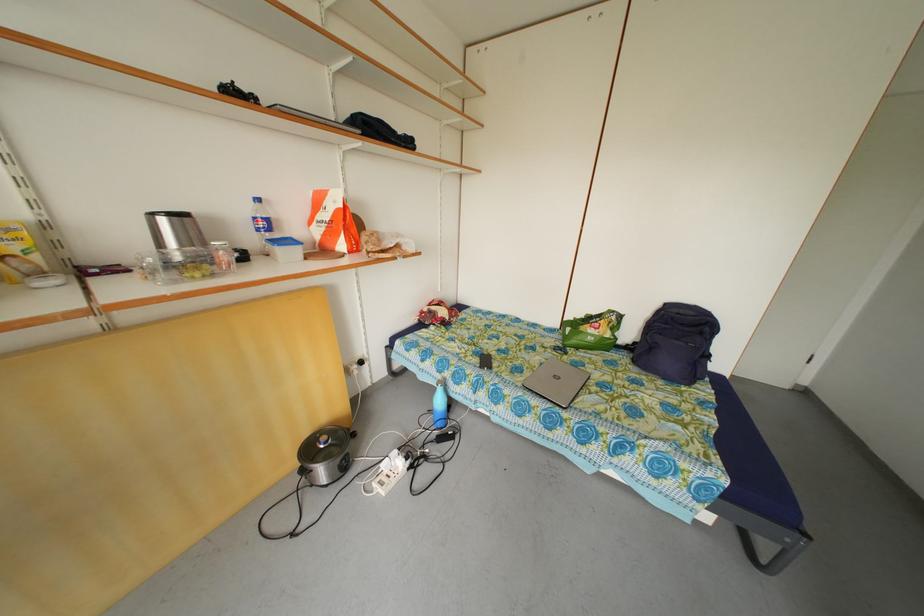
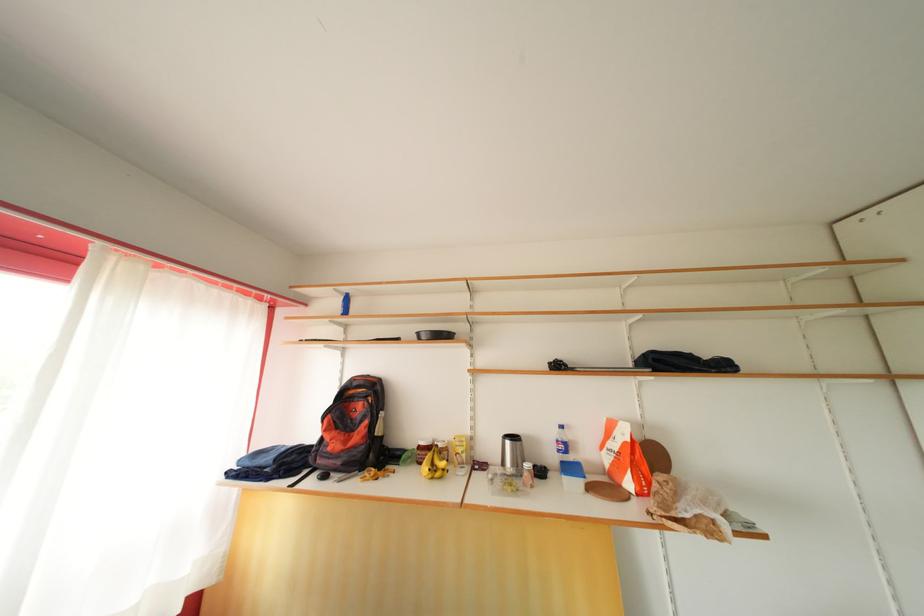
Where in the second image is the point corresponding to the point at 204,275 from the first image?

(517, 490)